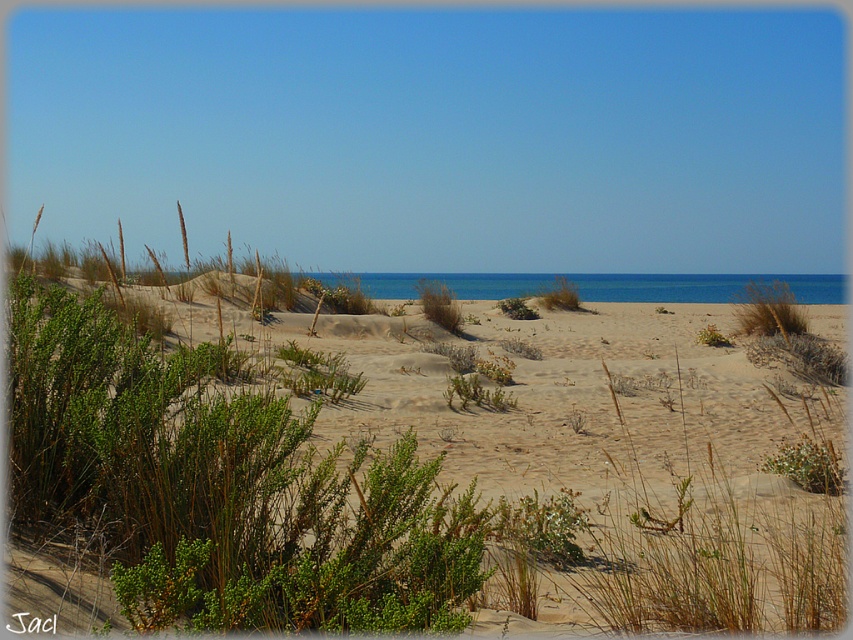
You are a hiker who wants to find the tallest vegetation in the area. Which one between the green shrubs at center and the green grass at center would you choose?

The green shrubs at center are much taller than the green grass at center, so you should choose the green shrubs at center.

Based on the photo, you are standing on the sandy dunes and see the green grass at center and the green leafy bush at center. Which one is closer to the ground?

The green grass at center is positioned under the green leafy bush at center, so the green grass at center is closer to the ground.

You are standing at the point labeled point (434,305) and want to walk to the point labeled point (434,596). Which direction should you face to walk towards your destination?

You should face towards the direction away from the viewer because point (434,596) is closer to the viewer than point (434,305).